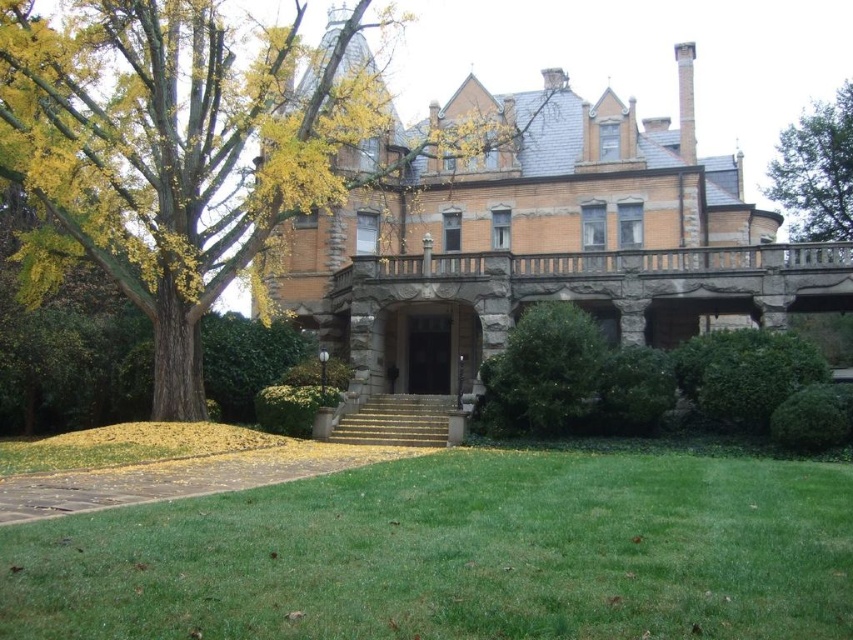
You are a gardener planning to mow the lawn. You have a lawnmower that can only handle areas smaller than the green leafy tree at upper right. Can you safely mow the green grass at lower center without exceeding your lawnmower capacity?

The green grass at lower center is smaller than the green leafy tree at upper right, so yes, you can safely mow the green grass at lower center since its area is within the lawnmower capacity.

You are standing on the lawn in front of the mansion and want to walk to the point marked by point (462, 216) and point (161, 342). Which point is closer to you?

Point (462, 216) is further to the viewer than point (161, 342), so the closer point is point (161, 342).

You are standing at the edge of the lawn in front of the Victorian mansion. You want to walk to the mansion entrance, which is at the top of the stone steps. The path you intend to take is directly across the green grass at lower center. Given that the grass is 26.32 meters away from you, can you estimate how many steps you would need to take to reach the mansion entrance?

The distance to the green grass at lower center is 26.32 meters. Assuming an average step length of about 0.76 meters, you would need approximately 34.6 steps. Since you can only take whole steps, you would need about 35 steps to cover the distance to the mansion entrance.